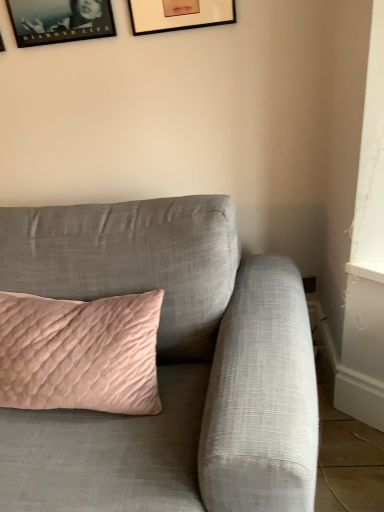
Question: Should I look upward or downward to see matte gray couch at center?

Choices:
 (A) down
 (B) up

Answer: (A)

Question: Is matte black picture frame at upper left, placed as the 2th picture frame when sorted from right to left, further to the viewer compared to matte black picture frame at upper center, which appears as the first picture frame when viewed from the right?

Choices:
 (A) yes
 (B) no

Answer: (A)

Question: Does matte black picture frame at upper left, placed as the 2th picture frame when sorted from right to left, have a larger size compared to matte black picture frame at upper center, marked as the 3th picture frame in a left-to-right arrangement?

Choices:
 (A) no
 (B) yes

Answer: (A)

Question: Is matte black picture frame at upper left, placed as the 2th picture frame when sorted from right to left, positioned with its back to matte black picture frame at upper center, marked as the 3th picture frame in a left-to-right arrangement?

Choices:
 (A) no
 (B) yes

Answer: (A)

Question: Can you confirm if matte black picture frame at upper left, the second picture frame from the left, is taller than matte black picture frame at upper center, marked as the 3th picture frame in a left-to-right arrangement?

Choices:
 (A) yes
 (B) no

Answer: (B)

Question: Does matte black picture frame at upper left, the second picture frame from the left, have a smaller size compared to matte black picture frame at upper center, which appears as the first picture frame when viewed from the right?

Choices:
 (A) no
 (B) yes

Answer: (B)

Question: From the image's perspective, is matte black picture frame at upper left, the second picture frame from the left, below matte black picture frame at upper center, marked as the 3th picture frame in a left-to-right arrangement?

Choices:
 (A) yes
 (B) no

Answer: (A)

Question: From the image's perspective, is matte black picture frame at upper left, which is counted as the first picture frame, starting from the left, on matte black picture frame at upper left, placed as the 2th picture frame when sorted from right to left?

Choices:
 (A) yes
 (B) no

Answer: (B)

Question: Is matte black picture frame at upper left, which is counted as the first picture frame, starting from the left, closer to the viewer compared to matte black picture frame at upper left, placed as the 2th picture frame when sorted from right to left?

Choices:
 (A) yes
 (B) no

Answer: (B)

Question: Can you confirm if matte black picture frame at upper left, which is counted as the first picture frame, starting from the left, is taller than matte black picture frame at upper left, placed as the 2th picture frame when sorted from right to left?

Choices:
 (A) yes
 (B) no

Answer: (A)

Question: Is matte black picture frame at upper left, which is counted as the first picture frame, starting from the left, further to the viewer compared to matte black picture frame at upper left, placed as the 2th picture frame when sorted from right to left?

Choices:
 (A) no
 (B) yes

Answer: (B)

Question: From a real-world perspective, does matte black picture frame at upper left, which is counted as the first picture frame, starting from the left, stand above matte black picture frame at upper left, the second picture frame from the left?

Choices:
 (A) yes
 (B) no

Answer: (B)

Question: Is matte black picture frame at upper left, which is counted as the first picture frame, starting from the left, to the right of matte black picture frame at upper left, placed as the 2th picture frame when sorted from right to left, from the viewer's perspective?

Choices:
 (A) no
 (B) yes

Answer: (A)

Question: Can we say matte black picture frame at upper center, marked as the 3th picture frame in a left-to-right arrangement, lies outside matte black picture frame at upper left, positioned as the 3th picture frame in right-to-left order?

Choices:
 (A) yes
 (B) no

Answer: (A)